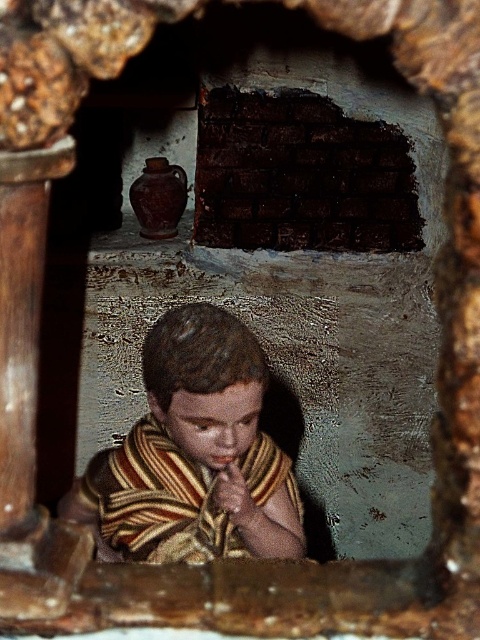
Question: Which point is closer to the camera?

Choices:
 (A) striped fabric child at center
 (B) dark brick wall at center

Answer: (A)

Question: Which point is farther from the camera taking this photo?

Choices:
 (A) (220, 435)
 (B) (367, 157)

Answer: (B)

Question: Is striped fabric child at center to the right of dark brick wall at center from the viewer's perspective?

Choices:
 (A) no
 (B) yes

Answer: (A)

Question: In this image, where is striped fabric child at center located relative to dark brick wall at center?

Choices:
 (A) left
 (B) right

Answer: (A)

Question: Is striped fabric child at center closer to the viewer compared to dark brick wall at center?

Choices:
 (A) no
 (B) yes

Answer: (B)

Question: Which object appears farthest from the camera in this image?

Choices:
 (A) dark brick wall at center
 (B) striped fabric child at center

Answer: (A)